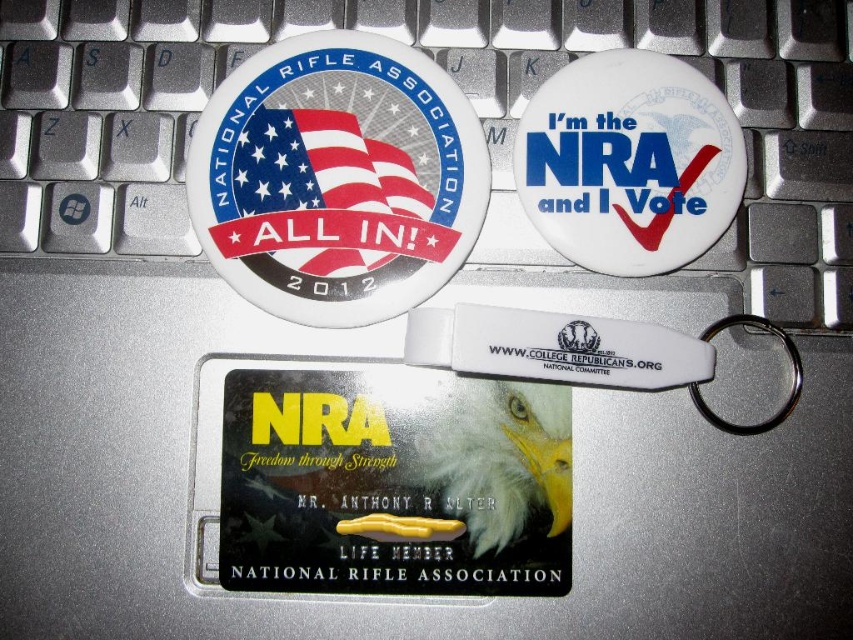
Is white matte button at upper right thinner than white matte eagle at center?

No, white matte button at upper right is not thinner than white matte eagle at center.

Is white matte button at upper right closer to the viewer compared to white matte eagle at center?

No, white matte button at upper right is behind white matte eagle at center.

Which is behind, point (738, 173) or point (532, 390)?

Positioned behind is point (738, 173).

Find the location of `white matte button at upper right`. white matte button at upper right is located at coordinates (630, 163).

Can you confirm if matte white button at center is positioned above white matte button at upper right?

Actually, matte white button at center is below white matte button at upper right.

Does matte white button at center have a smaller size compared to white matte button at upper right?

Actually, matte white button at center might be larger than white matte button at upper right.

Find the location of a particular element. matte white button at center is located at coordinates [x=337, y=179].

Measure the distance between matte white button at center and camera.

matte white button at center is 37.38 inches from camera.

Between matte white button at center and white matte eagle at center, which one has less height?

white matte eagle at center is shorter.

Identify the location of matte white button at center. Image resolution: width=853 pixels, height=640 pixels. (337, 179).